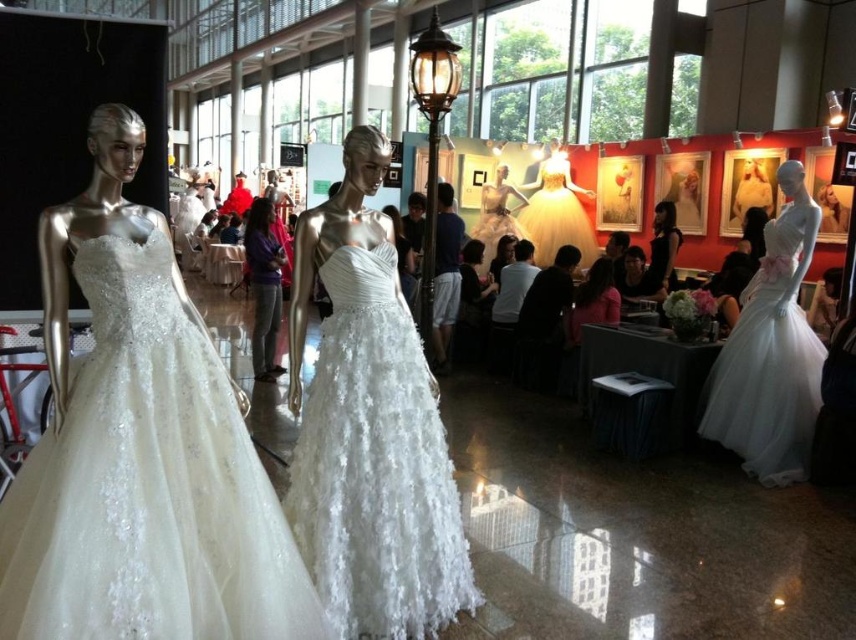
Question: Which of the following is the farthest from the observer?

Choices:
 (A) [x=556, y=232]
 (B) [x=167, y=621]
 (C) [x=728, y=422]
 (D) [x=495, y=208]

Answer: (A)

Question: Can you confirm if white textured gown at center is positioned above matte white gown at center?

Choices:
 (A) yes
 (B) no

Answer: (B)

Question: Which point is farther to the camera?

Choices:
 (A) ivory lace dress at center
 (B) matte silver mannequin at center

Answer: (B)

Question: Which point is farther to the camera?

Choices:
 (A) white tulle dress at right
 (B) matte white gown at center
 (C) ivory lace dress at center

Answer: (B)

Question: Does white textured gown at center have a lesser width compared to matte white gown at center?

Choices:
 (A) yes
 (B) no

Answer: (A)

Question: Does ivory lace dress at center appear over white textured gown at center?

Choices:
 (A) yes
 (B) no

Answer: (A)